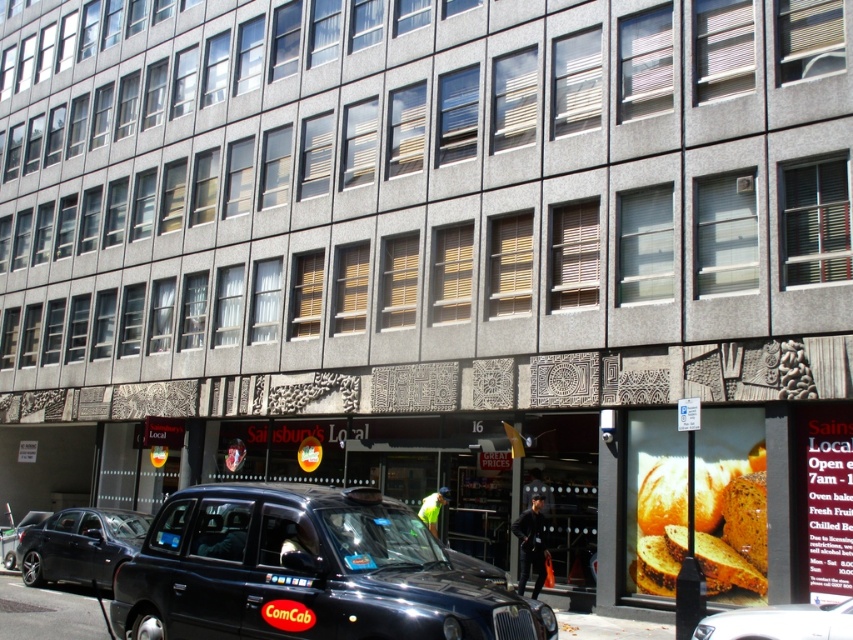
You are a delivery person needing to park your vehicle near the Sainsbury Local entrance. The shiny black taxi at center and the metallic silver car at lower left are both available. Which vehicle has enough space to park closer to the entrance without blocking the sidewalk?

The shiny black taxi at center is smaller than the metallic silver car at lower left, so the shiny black taxi at center requires less space and can park closer to the entrance without blocking the sidewalk.

You are a pedestrian standing in front of the Sainsbury Local entrance. You see a metallic silver car at lower left and a black plastic license plate at center. Which object is positioned more to the left side of the scene?

The metallic silver car at lower left is positioned more to the left side of the scene than the black plastic license plate at center.

You are a pedestrian standing at the entrance of Sainsbury Local. You need to cross the road to reach the bus stop. There is a shiny black taxi at center and a metallic silver car at lower left. Which vehicle is closer to you?

The shiny black taxi at center is closer to you because it is positioned over the metallic silver car at lower left, meaning it is in front of it from your perspective.